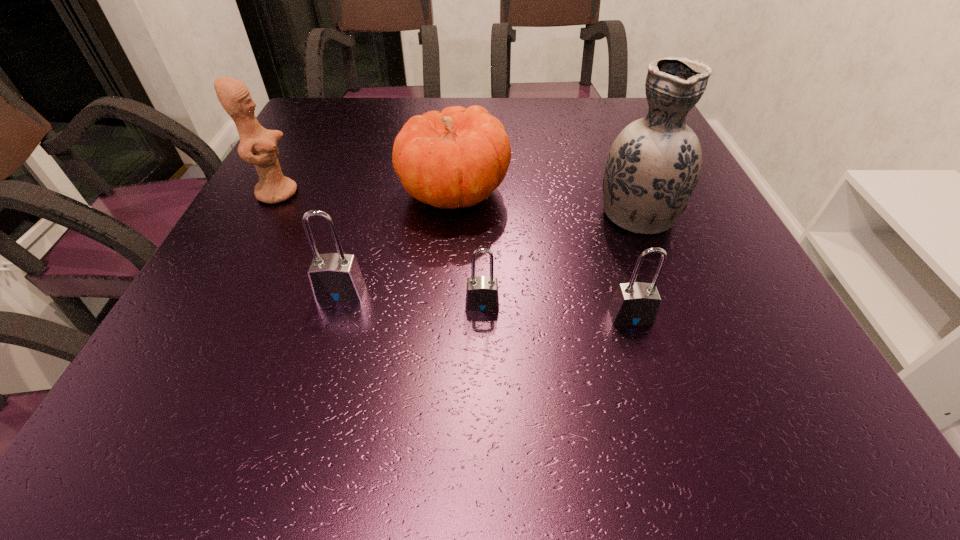
Identify the location of vacant area located 0.080m on the shackle of the rightmost padlock. (647, 370).

The image size is (960, 540). What are the coordinates of `vacant region located 0.070m on the back of the pumpkin` in the screenshot? It's located at (458, 145).

This screenshot has height=540, width=960. I want to click on vacant area located 0.230m with the handle on the side of the vase, so click(x=606, y=134).

At what (x,y) coordinates should I click in order to perform the action: click on vacant point located with the handle on the side of the vase. Please return your answer as a coordinate pair (x, y). Looking at the image, I should click on (599, 118).

You are a GUI agent. You are given a task and a screenshot of the screen. Output one action in this format:
    pyautogui.click(x=<x>, y=<y>)
    Task: Click on the free space located with the handle on the side of the vase
    The height and width of the screenshot is (540, 960).
    Given the screenshot: What is the action you would take?
    pyautogui.click(x=607, y=136)

Locate an element on the screen. This screenshot has height=540, width=960. vacant space located on the front-facing side of the second tallest object is located at coordinates (431, 193).

At what (x,y) coordinates should I click in order to perform the action: click on object at the near edge. Please return your answer as a coordinate pair (x, y). This screenshot has width=960, height=540. Looking at the image, I should click on (636, 303).

Find the location of a particular element. object present at the left edge is located at coordinates (258, 146).

The height and width of the screenshot is (540, 960). Find the location of `object present at the right edge`. object present at the right edge is located at coordinates (653, 166).

Find the location of a particular element. vacant space at the far edge of the desktop is located at coordinates click(x=540, y=98).